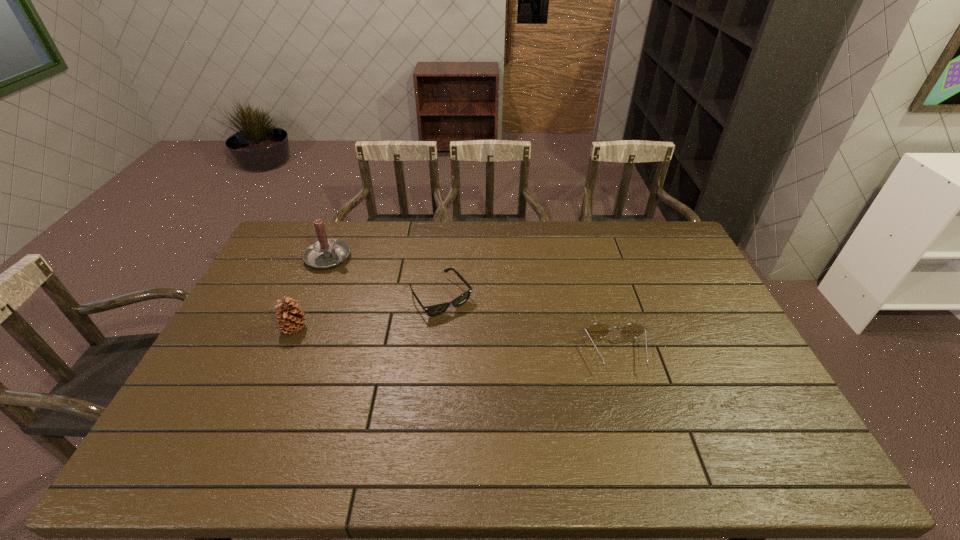
Locate an element on the screen. The width and height of the screenshot is (960, 540). vacant point at the left edge is located at coordinates (279, 334).

At what (x,y) coordinates should I click in order to perform the action: click on free location at the right edge. Please return your answer as a coordinate pair (x, y). Looking at the image, I should click on (691, 299).

Locate an element on the screen. The height and width of the screenshot is (540, 960). vacant region at the far left corner of the desktop is located at coordinates 325,225.

This screenshot has height=540, width=960. Identify the location of free space between the second tallest object and the third object from left to right. (368, 313).

Identify the location of free point between the sunglasses and the spectacles. (529, 325).

Identify the location of free spot between the rightmost object and the pinecone. (456, 341).

This screenshot has height=540, width=960. I want to click on free space between the third shortest object and the rightmost object, so pos(456,341).

Where is `free space between the pinecone and the second object from right to left`? The height and width of the screenshot is (540, 960). free space between the pinecone and the second object from right to left is located at coordinates (368, 313).

Identify the location of free spot between the tallest object and the sunglasses. (385, 278).

Image resolution: width=960 pixels, height=540 pixels. I want to click on vacant area that lies between the third shortest object and the spectacles, so click(456, 341).